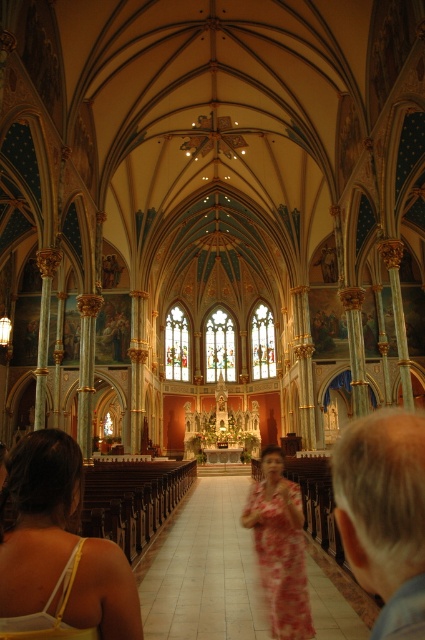
Question: Can you confirm if floral print fabric dress at center is positioned above yellow floral dress at lower left?

Choices:
 (A) no
 (B) yes

Answer: (A)

Question: Which point is farther to the camera?

Choices:
 (A) matte yellow tank top at lower left
 (B) gray hair at right

Answer: (A)

Question: Can you confirm if floral print fabric dress at center is positioned to the left of yellow floral dress at lower left?

Choices:
 (A) no
 (B) yes

Answer: (A)

Question: Which point is farther to the camera?

Choices:
 (A) matte yellow tank top at lower left
 (B) white tile aisle at center
 (C) gray hair at right

Answer: (B)

Question: Estimate the real-world distances between objects in this image. Which object is farther from the gray hair at right?

Choices:
 (A) floral print fabric dress at center
 (B) matte yellow tank top at lower left
 (C) white tile aisle at center

Answer: (C)

Question: Can you confirm if gray hair at right is thinner than yellow floral dress at lower left?

Choices:
 (A) no
 (B) yes

Answer: (A)